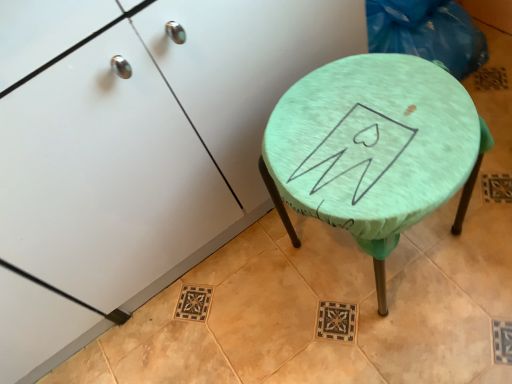
What do you see at coordinates (154, 142) in the screenshot? Image resolution: width=512 pixels, height=384 pixels. I see `mint fabric-covered stool at center-right` at bounding box center [154, 142].

Identify the location of mint fabric-covered stool at center-right. (154, 142).

What is the approximate height of mint fabric-covered stool at center-right?

mint fabric-covered stool at center-right is 30.45 inches in height.

Describe the element at coordinates (373, 149) in the screenshot. I see `teal fabric-covered stool at center` at that location.

Identify the location of teal fabric-covered stool at center. (373, 149).

This screenshot has height=384, width=512. I want to click on mint fabric-covered stool at center-right, so click(x=154, y=142).

Consider the image. Is mint fabric-covered stool at center-right to the left or to the right of teal fabric-covered stool at center in the image?

mint fabric-covered stool at center-right is positioned on teal fabric-covered stool at center's left side.

Is the position of mint fabric-covered stool at center-right more distant than that of teal fabric-covered stool at center?

No.

Which is in front, point (77, 145) or point (353, 105)?

The point (77, 145) is closer to the camera.

From the image's perspective, which one is positioned higher, mint fabric-covered stool at center-right or teal fabric-covered stool at center?

mint fabric-covered stool at center-right is shown above in the image.

From a real-world perspective, who is located lower, mint fabric-covered stool at center-right or teal fabric-covered stool at center?

From a 3D spatial view, teal fabric-covered stool at center is below.

Can you confirm if mint fabric-covered stool at center-right is wider than teal fabric-covered stool at center?

Correct, the width of mint fabric-covered stool at center-right exceeds that of teal fabric-covered stool at center.

Is mint fabric-covered stool at center-right shorter than teal fabric-covered stool at center?

In fact, mint fabric-covered stool at center-right may be taller than teal fabric-covered stool at center.

Considering the sizes of objects mint fabric-covered stool at center-right and teal fabric-covered stool at center in the image provided, who is smaller, mint fabric-covered stool at center-right or teal fabric-covered stool at center?

With smaller size is teal fabric-covered stool at center.

Is mint fabric-covered stool at center-right not inside teal fabric-covered stool at center?

Absolutely, mint fabric-covered stool at center-right is external to teal fabric-covered stool at center.

Is mint fabric-covered stool at center-right touching teal fabric-covered stool at center?

No, mint fabric-covered stool at center-right is not in contact with teal fabric-covered stool at center.

Is mint fabric-covered stool at center-right facing away from teal fabric-covered stool at center?

No, mint fabric-covered stool at center-right is not facing the opposite direction of teal fabric-covered stool at center.

Image resolution: width=512 pixels, height=384 pixels. What are the coordinates of `furniture in front of the teal fabric-covered stool at center` in the screenshot? It's located at (154, 142).

Which is more to the right, teal fabric-covered stool at center or mint fabric-covered stool at center-right?

From the viewer's perspective, teal fabric-covered stool at center appears more on the right side.

Is the position of teal fabric-covered stool at center less distant than that of mint fabric-covered stool at center-right?

No, the depth of teal fabric-covered stool at center is greater than that of mint fabric-covered stool at center-right.

Is point (378, 231) closer or farther from the camera than point (103, 44)?

Point (378, 231) appears to be farther away from the viewer than point (103, 44).

From the image's perspective, which is below, teal fabric-covered stool at center or mint fabric-covered stool at center-right?

teal fabric-covered stool at center, from the image's perspective.

From a real-world perspective, is teal fabric-covered stool at center on mint fabric-covered stool at center-right?

Actually, teal fabric-covered stool at center is physically below mint fabric-covered stool at center-right in the real world.

Between teal fabric-covered stool at center and mint fabric-covered stool at center-right, which one has smaller width?

With smaller width is teal fabric-covered stool at center.

Considering the relative sizes of teal fabric-covered stool at center and mint fabric-covered stool at center-right in the image provided, is teal fabric-covered stool at center taller than mint fabric-covered stool at center-right?

Incorrect, the height of teal fabric-covered stool at center is not larger of that of mint fabric-covered stool at center-right.

Considering the sizes of teal fabric-covered stool at center and mint fabric-covered stool at center-right in the image, is teal fabric-covered stool at center bigger or smaller than mint fabric-covered stool at center-right?

Considering their sizes, teal fabric-covered stool at center takes up less space than mint fabric-covered stool at center-right.

Is teal fabric-covered stool at center not within mint fabric-covered stool at center-right?

teal fabric-covered stool at center lies outside mint fabric-covered stool at center-right's area.

From the picture: Is teal fabric-covered stool at center not near mint fabric-covered stool at center-right?

Actually, teal fabric-covered stool at center and mint fabric-covered stool at center-right are a little close together.

Could you tell me if teal fabric-covered stool at center is facing mint fabric-covered stool at center-right?

→ No, teal fabric-covered stool at center does not turn towards mint fabric-covered stool at center-right.

Can you tell me how much teal fabric-covered stool at center and mint fabric-covered stool at center-right differ in facing direction?

They differ by 0.000184 degrees in their facing directions.

How much distance is there between teal fabric-covered stool at center and mint fabric-covered stool at center-right?

10.42 inches.

Where is `furniture that is above the teal fabric-covered stool at center (from the image's perspective)`? The height and width of the screenshot is (384, 512). furniture that is above the teal fabric-covered stool at center (from the image's perspective) is located at coordinates (154, 142).

Identify the location of stool on the right of mint fabric-covered stool at center-right. The height and width of the screenshot is (384, 512). (373, 149).

Identify the location of furniture that appears above the teal fabric-covered stool at center (from a real-world perspective). (154, 142).